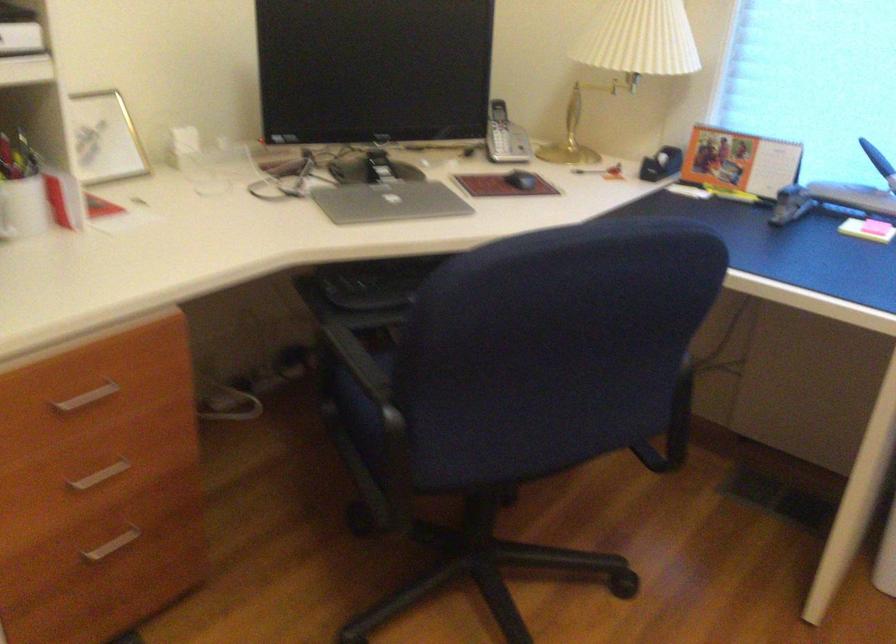
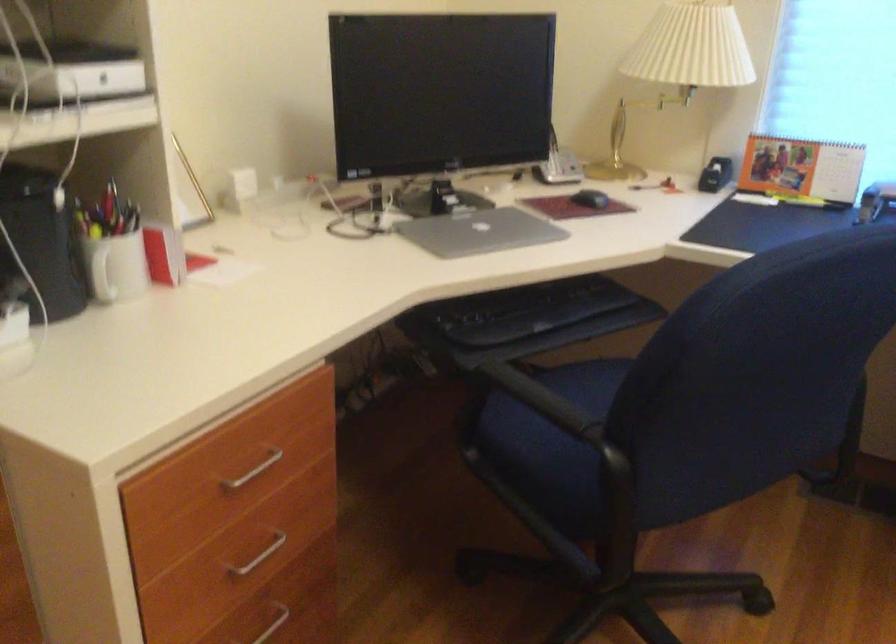
Question: The images are taken continuously from a first-person perspective. In which direction are you moving?

Choices:
 (A) Left
 (B) Right
 (C) Forward
 (D) Backward

Answer: (A)